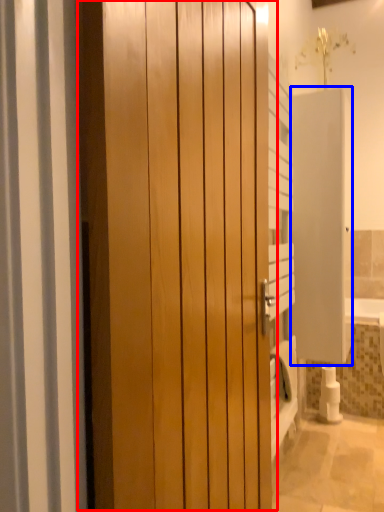
Question: Which object is further to the camera taking this photo, door (highlighted by a red box) or screen door (highlighted by a blue box)?

Choices:
 (A) door
 (B) screen door

Answer: (B)